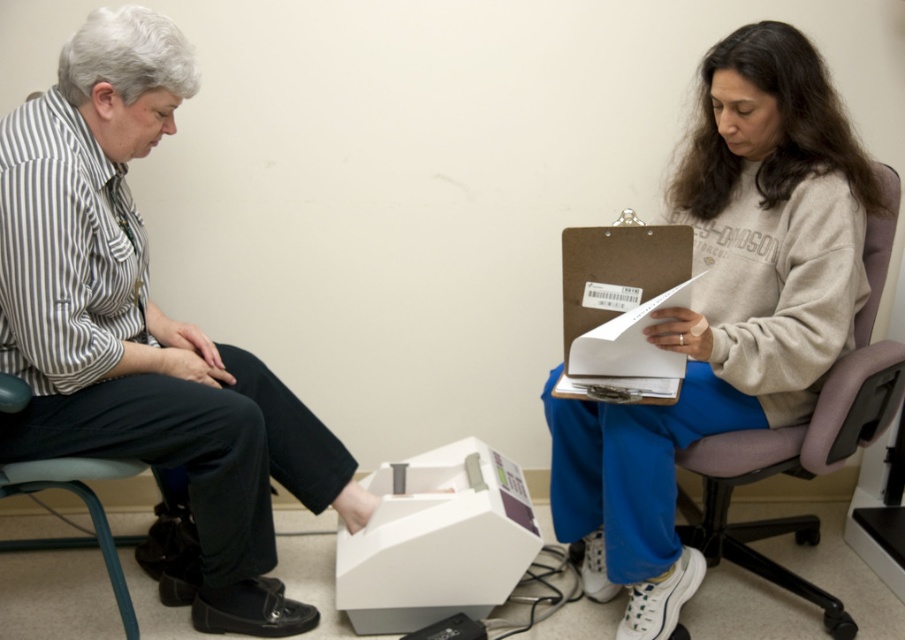
Can you confirm if matte black shoe at lower left is shorter than white plastic machine at lower center?

Incorrect, matte black shoe at lower left's height does not fall short of white plastic machine at lower center's.

Does matte black shoe at lower left have a greater width compared to white plastic machine at lower center?

Correct, the width of matte black shoe at lower left exceeds that of white plastic machine at lower center.

Is point (134, 72) closer to viewer compared to point (426, 452)?

Yes, it is in front of point (426, 452).

I want to click on matte black shoe at lower left, so click(144, 326).

Can you confirm if matte gray sweatshirt at center is thinner than gray fabric armchair at right?

In fact, matte gray sweatshirt at center might be wider than gray fabric armchair at right.

Identify the location of matte gray sweatshirt at center. This screenshot has width=905, height=640. (724, 312).

You are a GUI agent. You are given a task and a screenshot of the screen. Output one action in this format:
    pyautogui.click(x=<x>, y=<y>)
    Task: Click on the matte gray sweatshirt at center
    
    Given the screenshot: What is the action you would take?
    pyautogui.click(x=724, y=312)

Between matte black shoe at lower left and matte gray sweatshirt at center, which one appears on the left side from the viewer's perspective?

From the viewer's perspective, matte black shoe at lower left appears more on the left side.

The height and width of the screenshot is (640, 905). Identify the location of matte black shoe at lower left. (144, 326).